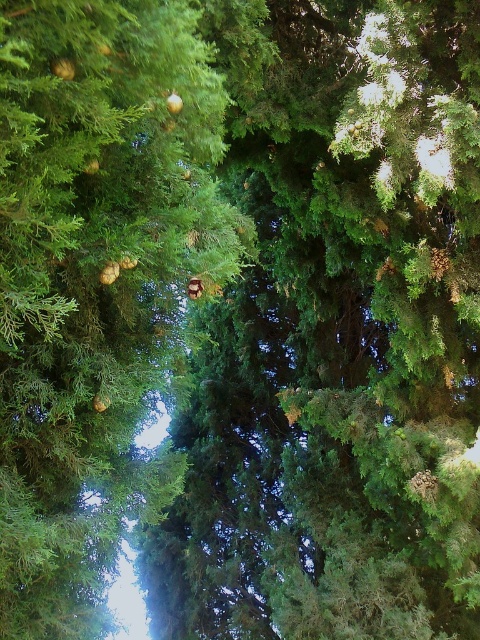
Does green textured pine tree at center have a lesser width compared to green matte pine cone at upper center?

No.

Locate an element on the screen. The image size is (480, 640). green textured pine tree at center is located at coordinates (338, 339).

Find the location of a particular element. Image resolution: width=480 pixels, height=640 pixels. green textured pine tree at center is located at coordinates (338, 339).